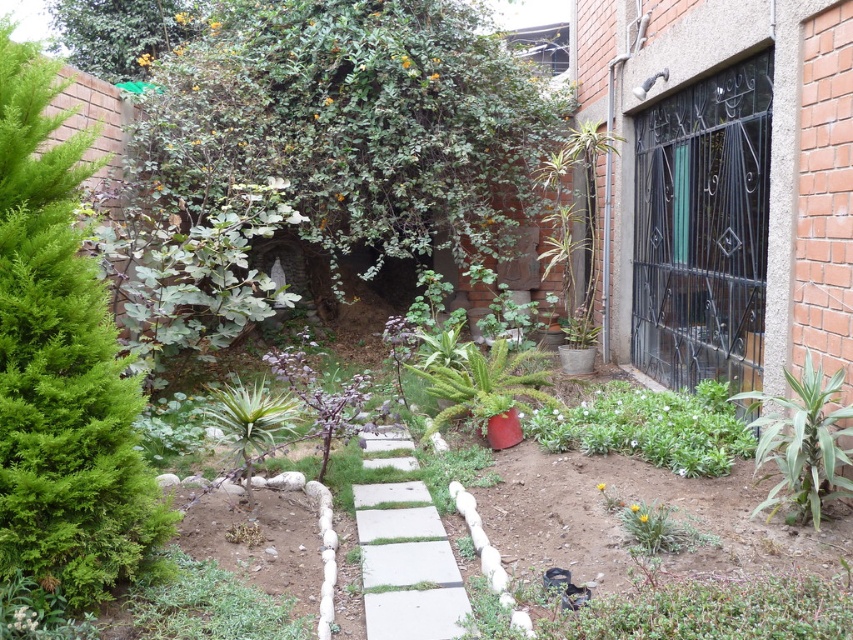
You are a gardener who wants to place a new decorative statue on the concrete at center without blocking the pathway. Can you place it there considering the green leafy bush at left?

The green leafy bush at left is positioned over the concrete at center, so placing the statue there might be obstructed by the bush. Choose another location.

You are standing at the entrance of the garden and want to walk towards the black metal gate with decorative patterns. Which object will you pass first, the green leafy bush at left or the green leafy plant at lower center?

The green leafy bush at left is in front of the green leafy plant at lower center, so you will pass the green leafy bush at left first on your way to the gate.